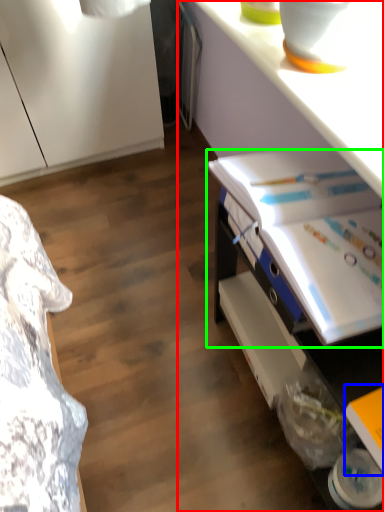
Question: Considering the real-world distances, which object is farthest from desk (highlighted by a red box)? book (highlighted by a blue box) or book (highlighted by a green box)?

Choices:
 (A) book
 (B) book

Answer: (A)